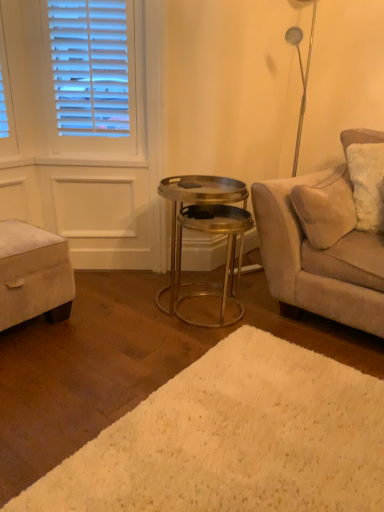
Question: Would you say white shag rug at lower center is inside or outside suede beige couch at right?

Choices:
 (A) inside
 (B) outside

Answer: (B)

Question: In the image, is white shag rug at lower center on the left side or the right side of suede beige couch at right?

Choices:
 (A) right
 (B) left

Answer: (B)

Question: Which is nearer to the velvet beige ottoman at lower left?

Choices:
 (A) white shag rug at lower center
 (B) metallic/golden table at center
 (C) suede beige couch at right

Answer: (B)

Question: Which object is the closest to the suede beige couch at right?

Choices:
 (A) metallic/golden table at center
 (B) velvet beige ottoman at lower left
 (C) white shag rug at lower center

Answer: (A)